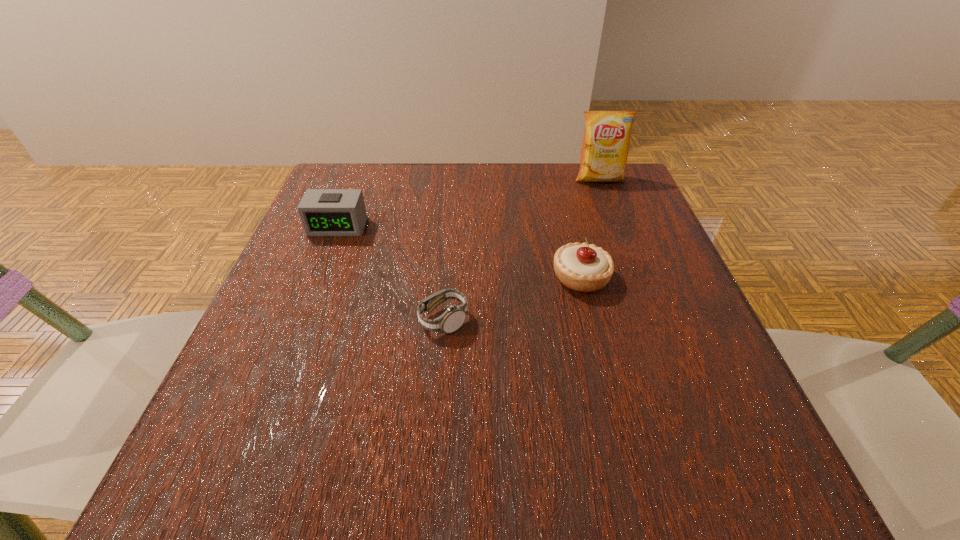
This screenshot has height=540, width=960. What are the coordinates of `free space at the left edge of the desktop` in the screenshot? It's located at (316, 346).

I want to click on free space at the right edge, so click(x=596, y=238).

You are a GUI agent. You are given a task and a screenshot of the screen. Output one action in this format:
    pyautogui.click(x=<x>, y=<y>)
    Task: Click on the free space at the far left corner of the desktop
    This screenshot has width=960, height=540.
    Given the screenshot: What is the action you would take?
    pyautogui.click(x=384, y=200)

Where is `free space at the far right corner`? free space at the far right corner is located at coordinates (629, 190).

The image size is (960, 540). Find the location of `free point between the nearest object and the crisp (potato chip)`. free point between the nearest object and the crisp (potato chip) is located at coordinates (521, 249).

Identify the location of free spot between the alarm clock and the pastry. (459, 252).

Find the location of a particular element. free area in between the third object from right to left and the third farthest object is located at coordinates (512, 299).

This screenshot has height=540, width=960. In order to click on free space between the alarm clock and the crisp (potato chip) in this screenshot , I will do `click(468, 202)`.

I want to click on vacant area that lies between the third farthest object and the crisp (potato chip), so click(590, 228).

Find the location of a particular element. Image resolution: width=960 pixels, height=540 pixels. unoccupied position between the tallest object and the alarm clock is located at coordinates coord(468,202).